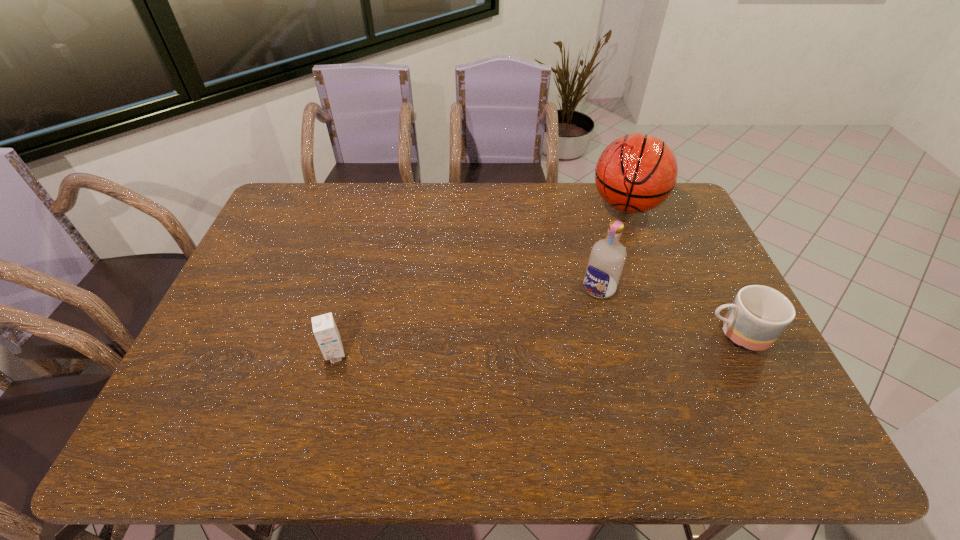
Identify the location of vacant space at the left edge of the desktop. This screenshot has height=540, width=960. (283, 255).

The width and height of the screenshot is (960, 540). I want to click on vacant space at the right edge, so click(x=672, y=247).

This screenshot has height=540, width=960. In the image, there is a desktop. Find the location of `vacant space at the far right corner`. vacant space at the far right corner is located at coordinates (675, 207).

You are a GUI agent. You are given a task and a screenshot of the screen. Output one action in this format:
    pyautogui.click(x=<x>, y=<y>)
    Task: Click on the unoccupied area between the chocolate milk and the shortest object
    Image resolution: width=960 pixels, height=540 pixels.
    Given the screenshot: What is the action you would take?
    pyautogui.click(x=536, y=345)

Find the location of a particular element. free spot between the shortest object and the second farthest object is located at coordinates (667, 311).

This screenshot has width=960, height=540. Identify the location of vacant region between the shortest object and the third nearest object. (667, 311).

Locate an element on the screen. This screenshot has height=540, width=960. vacant space that's between the shortest object and the chocolate milk is located at coordinates (536, 345).

At what (x,y) coordinates should I click in order to perform the action: click on free space that is in between the leftmost object and the mug. Please return your answer as a coordinate pair (x, y). This screenshot has height=540, width=960. Looking at the image, I should click on (536, 345).

I want to click on the second closest object to the vodka, so click(x=637, y=172).

Identify which object is the third nearest to the vodka. Please provide its 2D coordinates. Your answer should be formatted as a tuple, i.e. [(x, y)], where the tuple contains the x and y coordinates of a point satisfying the conditions above.

[(325, 330)]